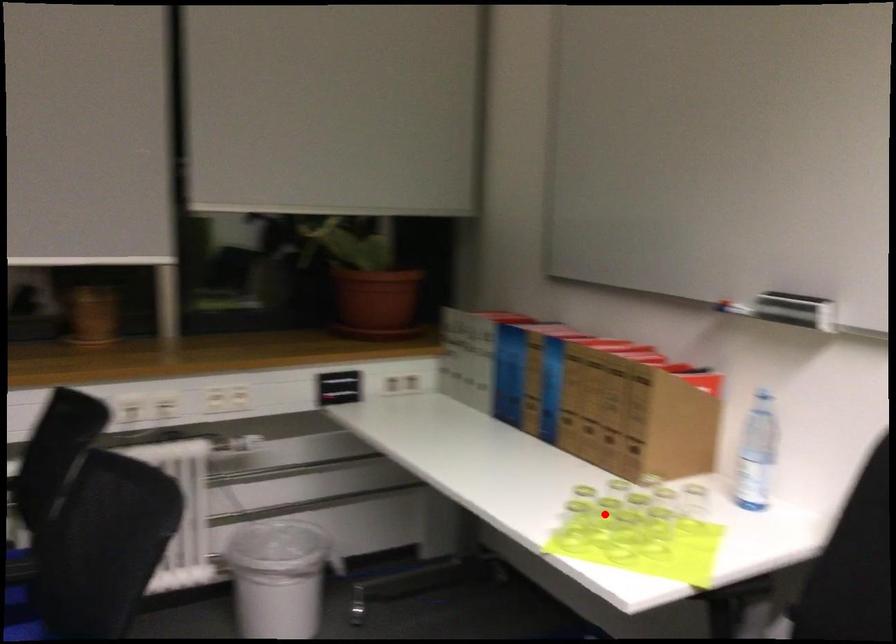
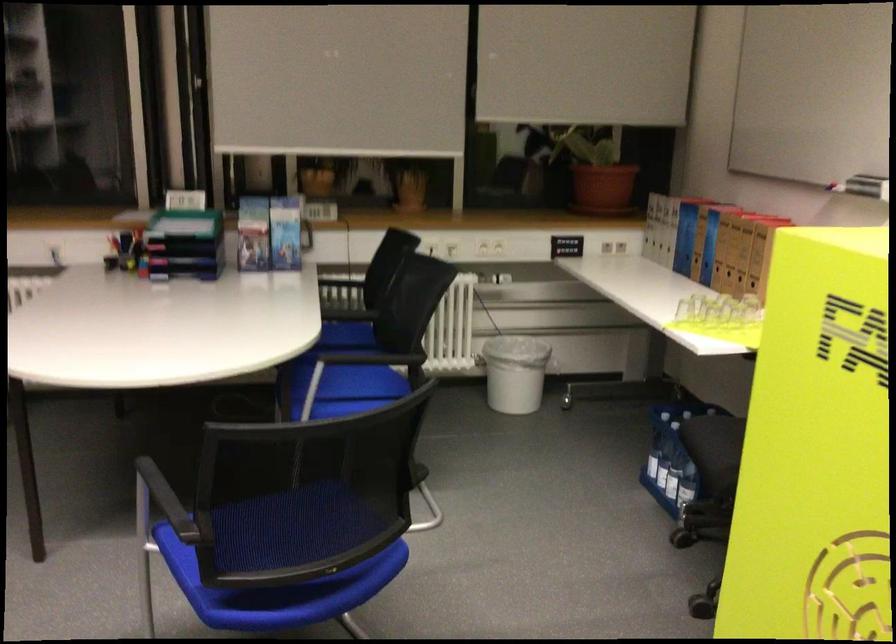
In the second image, find the point that corresponds to the highlighted location in the first image.

(713, 310)